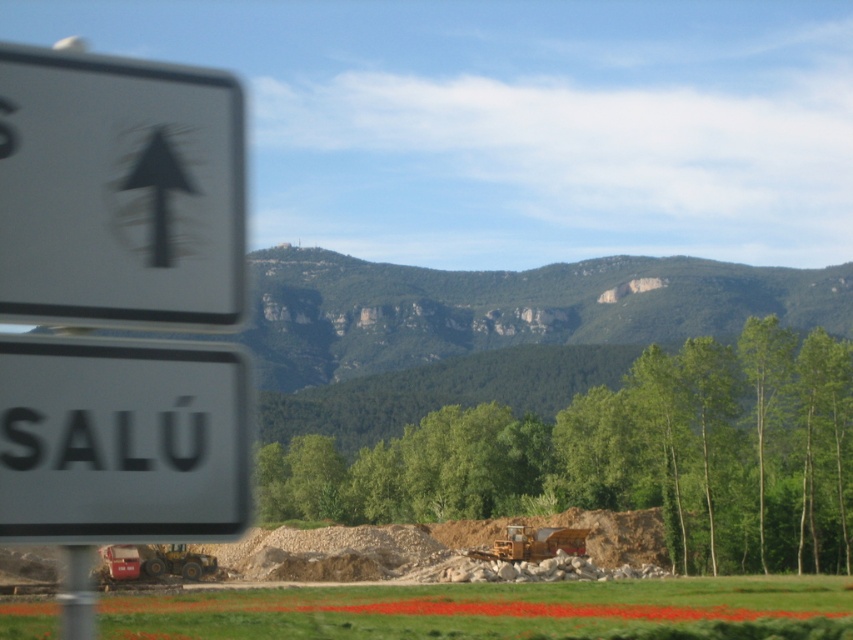
Question: Where is white plastic sign at lower left located in relation to metallic pole at left in the image?

Choices:
 (A) above
 (B) below

Answer: (A)

Question: Which is nearer to the metallic pole at left?

Choices:
 (A) yellow metallic excavator at center
 (B) white plastic arrow at upper left

Answer: (B)

Question: Which object is closer to the camera taking this photo?

Choices:
 (A) white plastic arrow at upper left
 (B) metallic pole at left
 (C) yellow metallic excavator at center
 (D) white plastic sign at lower left

Answer: (D)

Question: Is metallic pole at left positioned in front of yellow metallic excavator at center?

Choices:
 (A) no
 (B) yes

Answer: (B)

Question: Which of the following is the farthest from the observer?

Choices:
 (A) white plastic sign at lower left
 (B) yellow metallic excavator at center

Answer: (B)

Question: Does white plastic arrow at upper left have a smaller size compared to white plastic sign at lower left?

Choices:
 (A) yes
 (B) no

Answer: (B)